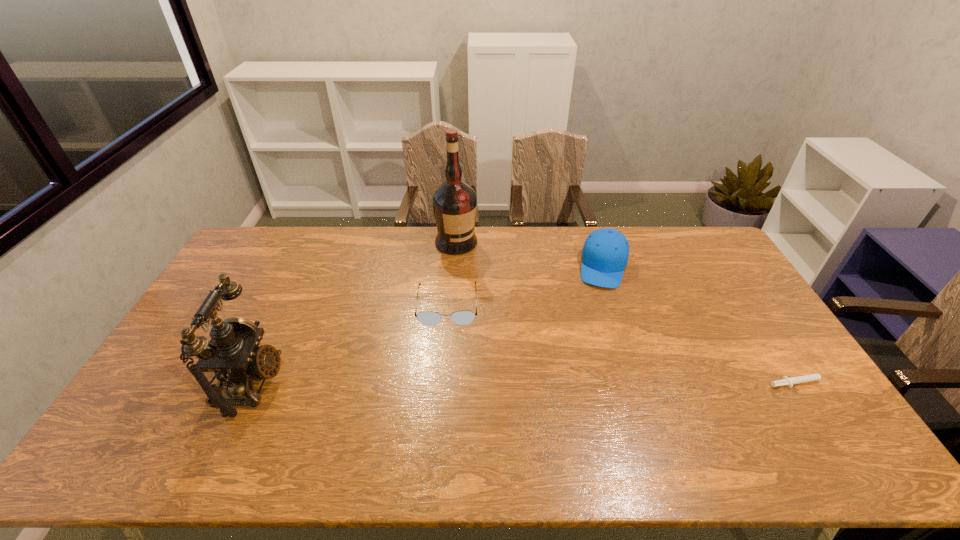
The height and width of the screenshot is (540, 960). Identify the location of cap at the far edge. (605, 253).

This screenshot has width=960, height=540. Identify the location of object that is at the near edge. (232, 355).

At what (x,y) coordinates should I click in order to perform the action: click on object that is at the right edge. Please return your answer as a coordinate pair (x, y). Looking at the image, I should click on coord(789,382).

The width and height of the screenshot is (960, 540). In order to click on vacant space at the far edge in this screenshot , I will do `click(491, 227)`.

Find the location of a particular element. vacant space at the left edge of the desktop is located at coordinates (204, 337).

The image size is (960, 540). In the image, there is a desktop. In order to click on blank space at the right edge in this screenshot , I will do `click(735, 276)`.

At what (x,y) coordinates should I click in order to perform the action: click on free space at the far left corner of the desktop. Please return your answer as a coordinate pair (x, y). Image resolution: width=960 pixels, height=540 pixels. Looking at the image, I should click on (270, 256).

Where is `blank area at the far right corner`? blank area at the far right corner is located at coordinates (718, 251).

I want to click on free spot between the rightmost object and the second shortest object, so click(x=625, y=344).

This screenshot has width=960, height=540. In order to click on vacant space that's between the second shortest object and the cap in this screenshot , I will do `click(525, 286)`.